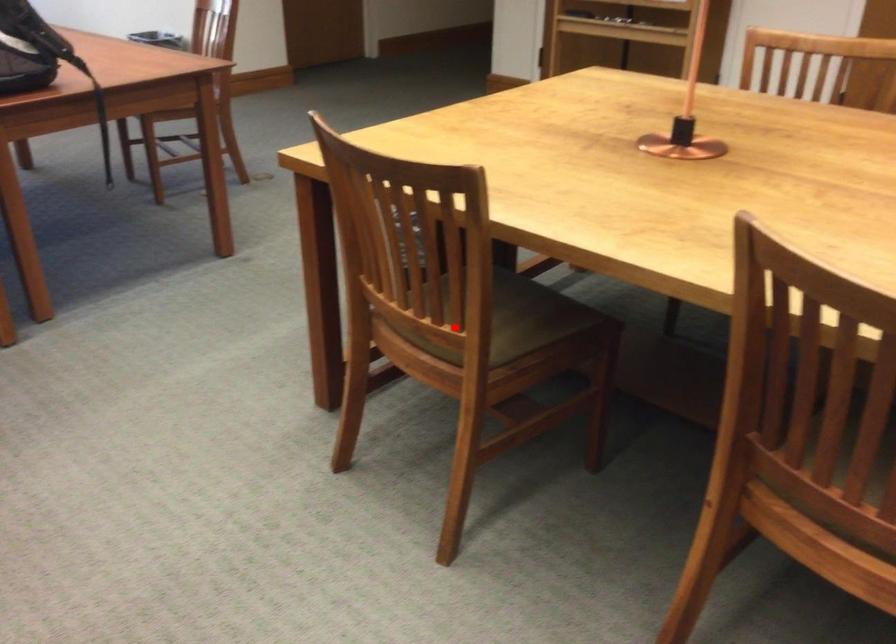
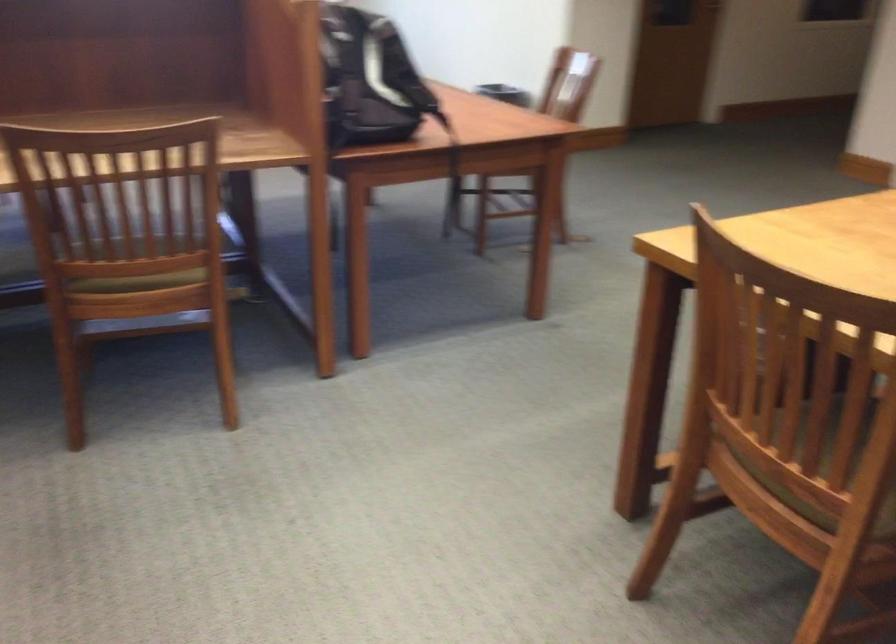
Question: A red point is marked in image1. In image2, is the corresponding 3D point closer to the camera or farther? Reply with the corresponding letter.

Choices:
 (A) The corresponding 3D point is closer.
 (B) The corresponding 3D point is farther.

Answer: (A)